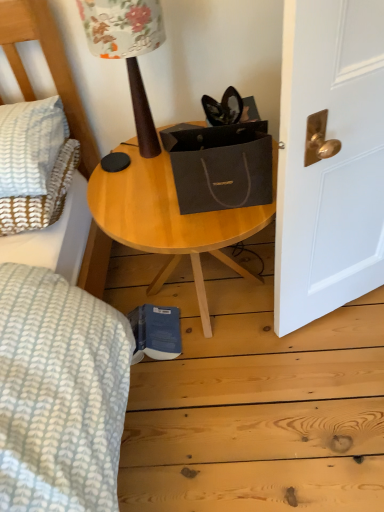
Question: Is white textured pillow at left inside or outside of wooden table at center?

Choices:
 (A) outside
 (B) inside

Answer: (A)

Question: Relative to wooden table at center, is white textured pillow at left in front or behind?

Choices:
 (A) front
 (B) behind

Answer: (B)

Question: Based on their relative distances, which object is farther from the wooden table at center?

Choices:
 (A) white textured pillow at left
 (B) wooden table lamp at upper center

Answer: (A)

Question: Estimate the real-world distances between objects in this image. Which object is closer to the wooden table lamp at upper center?

Choices:
 (A) white textured pillow at left
 (B) wooden table at center

Answer: (B)